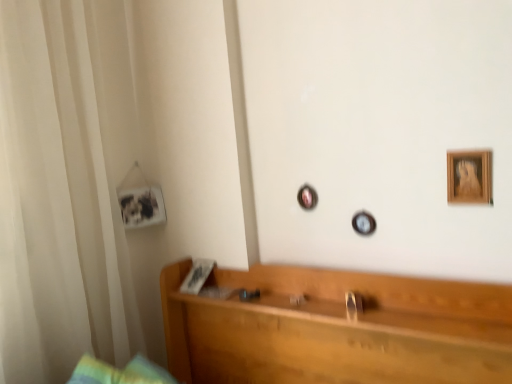
This screenshot has height=384, width=512. What do you see at coordinates (65, 187) in the screenshot?
I see `white sheer curtain at left` at bounding box center [65, 187].

Where is `matte white photo frame at left, positioned as the 1th picture frame in left-to-right order`? The height and width of the screenshot is (384, 512). matte white photo frame at left, positioned as the 1th picture frame in left-to-right order is located at coordinates pos(141,206).

The height and width of the screenshot is (384, 512). Identify the location of wooden picture frame at upper right, placed as the 2th picture frame when sorted from left to right. (469, 177).

The width and height of the screenshot is (512, 384). I want to click on white sheer curtain at left, so click(65, 187).

From the image's perspective, is matte white photo frame at left, positioned as the 1th picture frame in back-to-front order, beneath wooden picture frame at upper right, positioned as the 1th picture frame in right-to-left order?

Indeed, from the image's perspective, matte white photo frame at left, positioned as the 1th picture frame in back-to-front order, is shown beneath wooden picture frame at upper right, positioned as the 1th picture frame in right-to-left order.

Is matte white photo frame at left, the 2th picture frame in the front-to-back sequence, positioned behind wooden picture frame at upper right, placed as the 2th picture frame when sorted from left to right?

That is True.

Is matte white photo frame at left, positioned as the 2th picture frame in right-to-left order, looking in the opposite direction of wooden picture frame at upper right, placed as the 2th picture frame when sorted from left to right?

No, matte white photo frame at left, positioned as the 2th picture frame in right-to-left order, is not facing the opposite direction of wooden picture frame at upper right, placed as the 2th picture frame when sorted from left to right.

From a real-world perspective, is matte white photo frame at left, positioned as the 1th picture frame in left-to-right order, located higher than wooden picture frame at upper right, the first picture frame viewed from the front?

Indeed, from a real-world perspective, matte white photo frame at left, positioned as the 1th picture frame in left-to-right order, stands above wooden picture frame at upper right, the first picture frame viewed from the front.

Is matte white photo frame at left, the 2th picture frame in the front-to-back sequence, inside or outside of wooden headboard at center?

The correct answer is: outside.

From the image's perspective, would you say matte white photo frame at left, positioned as the 1th picture frame in left-to-right order, is shown under wooden headboard at center?

No, from the image's perspective, matte white photo frame at left, positioned as the 1th picture frame in left-to-right order, is not beneath wooden headboard at center.

Locate an element on the screen. The image size is (512, 384). furniture below the matte white photo frame at left, the 2th picture frame in the front-to-back sequence (from the image's perspective) is located at coordinates (336, 329).

The height and width of the screenshot is (384, 512). I want to click on curtain lying on the left of wooden picture frame at upper right, the first picture frame viewed from the front, so tap(65, 187).

Which object is further away from the camera taking this photo, white sheer curtain at left or wooden picture frame at upper right, the first picture frame viewed from the front?

Positioned behind is white sheer curtain at left.

From a real-world perspective, is white sheer curtain at left positioned over wooden picture frame at upper right, placed as the 2th picture frame when sorted from left to right, based on gravity?

Correct, in the physical world, white sheer curtain at left is higher than wooden picture frame at upper right, placed as the 2th picture frame when sorted from left to right.

Looking at this image, from a real-world perspective, which object stands above the other?

From a 3D spatial view, white sheer curtain at left is above.

Considering the points (138, 206) and (105, 117), which point is behind, point (138, 206) or point (105, 117)?

The point (138, 206) is farther.

Is the position of matte white photo frame at left, the 2th picture frame in the front-to-back sequence, less distant than that of white sheer curtain at left?

That is False.

Which of these two, matte white photo frame at left, positioned as the 1th picture frame in back-to-front order, or white sheer curtain at left, stands shorter?

Standing shorter between the two is matte white photo frame at left, positioned as the 1th picture frame in back-to-front order.

Considering the relative positions of wooden picture frame at upper right, placed as the 2th picture frame when sorted from left to right, and wooden headboard at center in the image provided, is wooden picture frame at upper right, placed as the 2th picture frame when sorted from left to right, to the right of wooden headboard at center from the viewer's perspective?

Indeed, wooden picture frame at upper right, placed as the 2th picture frame when sorted from left to right, is positioned on the right side of wooden headboard at center.

Is wooden picture frame at upper right, the 2th picture frame in the back-to-front sequence, taller or shorter than wooden headboard at center?

Clearly, wooden picture frame at upper right, the 2th picture frame in the back-to-front sequence, is taller compared to wooden headboard at center.

Is wooden picture frame at upper right, the first picture frame viewed from the front, far away from wooden headboard at center?

→ wooden picture frame at upper right, the first picture frame viewed from the front, is near wooden headboard at center, not far away.

Consider the image. Considering the relative positions of wooden picture frame at upper right, the first picture frame viewed from the front, and wooden headboard at center in the image provided, is wooden picture frame at upper right, the first picture frame viewed from the front, in front of wooden headboard at center?

No, wooden picture frame at upper right, the first picture frame viewed from the front, is further to the viewer.

From the image's perspective, is white sheer curtain at left positioned above or below wooden headboard at center?

Clearly, from the image's perspective, white sheer curtain at left is above wooden headboard at center.

Is white sheer curtain at left surrounding wooden headboard at center?

That's incorrect, wooden headboard at center is not inside white sheer curtain at left.

Based on the photo, considering the relative positions of white sheer curtain at left and wooden headboard at center in the image provided, is white sheer curtain at left to the left or to the right of wooden headboard at center?

white sheer curtain at left is positioned on wooden headboard at center's left side.

Are white sheer curtain at left and wooden headboard at center beside each other?

No, white sheer curtain at left is not next to wooden headboard at center.

Locate an element on the screen. The width and height of the screenshot is (512, 384). curtain behind the wooden headboard at center is located at coordinates (65, 187).

Can you confirm if wooden headboard at center is bigger than white sheer curtain at left?

No.

Considering the relative positions of wooden headboard at center and white sheer curtain at left in the image provided, is wooden headboard at center to the left of white sheer curtain at left from the viewer's perspective?

No, wooden headboard at center is not to the left of white sheer curtain at left.

The width and height of the screenshot is (512, 384). I want to click on picture frame located underneath the matte white photo frame at left, positioned as the 2th picture frame in right-to-left order (from a real-world perspective), so click(x=469, y=177).

Image resolution: width=512 pixels, height=384 pixels. What are the coordinates of `furniture on the right of matte white photo frame at left, positioned as the 1th picture frame in left-to-right order` in the screenshot? It's located at (336, 329).

Considering their positions, is wooden headboard at center positioned closer to white sheer curtain at left than matte white photo frame at left, positioned as the 1th picture frame in left-to-right order?

Among the two, matte white photo frame at left, positioned as the 1th picture frame in left-to-right order, is located nearer to white sheer curtain at left.

From the image, which object appears to be nearer to wooden picture frame at upper right, the first picture frame viewed from the front, white sheer curtain at left or wooden headboard at center?

Based on the image, wooden headboard at center appears to be nearer to wooden picture frame at upper right, the first picture frame viewed from the front.

Consider the image. Which object lies nearer to the anchor point wooden headboard at center, wooden picture frame at upper right, the 2th picture frame in the back-to-front sequence, or white sheer curtain at left?

Based on the image, wooden picture frame at upper right, the 2th picture frame in the back-to-front sequence, appears to be nearer to wooden headboard at center.

When comparing their distances from matte white photo frame at left, positioned as the 1th picture frame in back-to-front order, does wooden headboard at center or wooden picture frame at upper right, the first picture frame viewed from the front, seem further?

Among the two, wooden picture frame at upper right, the first picture frame viewed from the front, is located further to matte white photo frame at left, positioned as the 1th picture frame in back-to-front order.

Based on their spatial positions, is white sheer curtain at left or matte white photo frame at left, positioned as the 1th picture frame in back-to-front order, closer to wooden headboard at center?

white sheer curtain at left is closer to wooden headboard at center.

Considering their positions, is wooden headboard at center positioned closer to white sheer curtain at left than wooden picture frame at upper right, the 2th picture frame in the back-to-front sequence?

The object closer to white sheer curtain at left is wooden headboard at center.

Considering their positions, is wooden picture frame at upper right, placed as the 2th picture frame when sorted from left to right, positioned further to white sheer curtain at left than matte white photo frame at left, positioned as the 2th picture frame in right-to-left order?

wooden picture frame at upper right, placed as the 2th picture frame when sorted from left to right.

Estimate the real-world distances between objects in this image. Which object is closer to wooden headboard at center, wooden picture frame at upper right, the 2th picture frame in the back-to-front sequence, or matte white photo frame at left, the 2th picture frame in the front-to-back sequence?

wooden picture frame at upper right, the 2th picture frame in the back-to-front sequence, lies closer to wooden headboard at center than the other object.

This screenshot has height=384, width=512. Identify the location of picture frame between white sheer curtain at left and wooden picture frame at upper right, the first picture frame viewed from the front, in the horizontal direction. (141, 206).

The width and height of the screenshot is (512, 384). I want to click on picture frame situated between white sheer curtain at left and wooden headboard at center from left to right, so click(x=141, y=206).

The width and height of the screenshot is (512, 384). I want to click on furniture between matte white photo frame at left, positioned as the 1th picture frame in back-to-front order, and wooden picture frame at upper right, the first picture frame viewed from the front, so click(x=336, y=329).

Locate an element on the screen. The height and width of the screenshot is (384, 512). furniture located between white sheer curtain at left and wooden picture frame at upper right, the first picture frame viewed from the front, in the left-right direction is located at coordinates (336, 329).